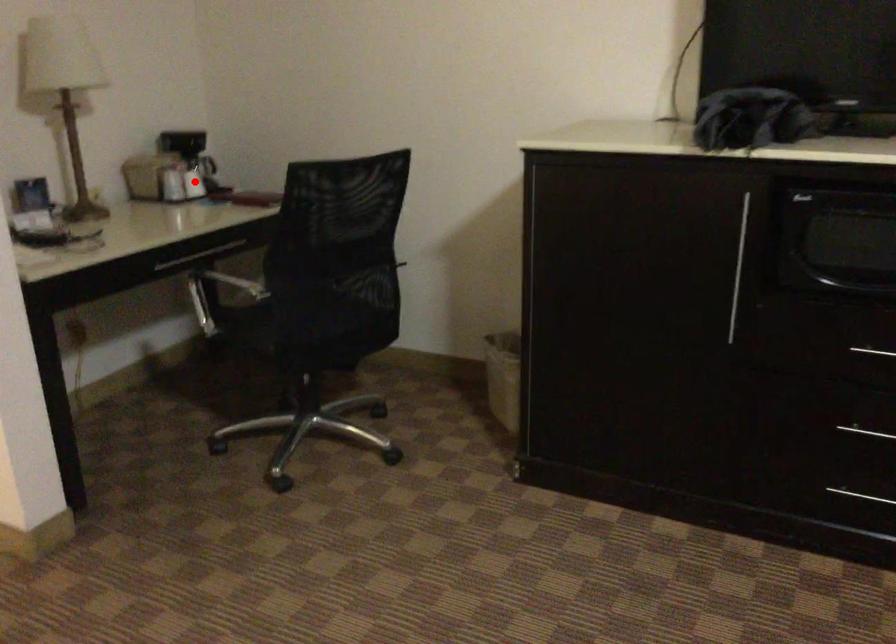
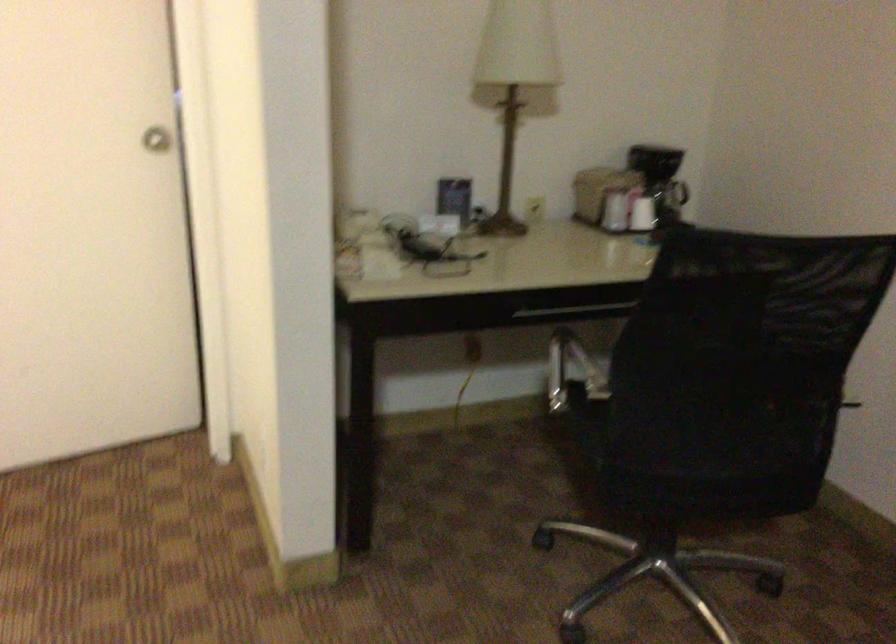
Question: I am providing you with two images of the same scene from different viewpoints. In image1, a red point is highlighted. Considering the same 3D point in image2, which of the following is correct?

Choices:
 (A) It is closer
 (B) It is farther

Answer: (A)